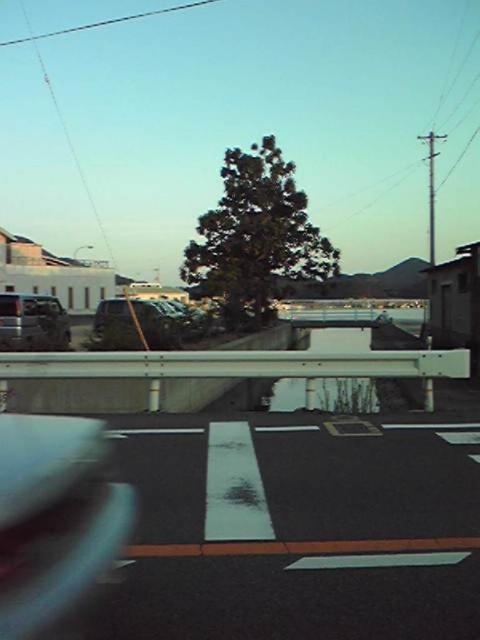
Find the location of a particular element. The image size is (480, 640). metallic silver car at center is located at coordinates (135, 324).

Does metallic silver car at center have a lesser width compared to transparent glass car window at lower left?

No.

What do you see at coordinates (135, 324) in the screenshot? I see `metallic silver car at center` at bounding box center [135, 324].

Find the location of a particular element. The image size is (480, 640). metallic silver car at center is located at coordinates (135, 324).

Who is taller, metallic silver car at center or metallic silver suv at left?

metallic silver suv at left

Who is positioned more to the left, metallic silver car at center or metallic silver suv at left?

From the viewer's perspective, metallic silver suv at left appears more on the left side.

Who is more forward, (122, 337) or (9, 298)?

Positioned in front is point (122, 337).

I want to click on metallic silver car at center, so click(135, 324).

Between metallic silver suv at left and transparent glass car window at lower left, which one has more height?

metallic silver suv at left is taller.

Is point (62, 339) in front of point (11, 298)?

Yes, point (62, 339) is in front of point (11, 298).

At what (x,y) coordinates should I click in order to perform the action: click on metallic silver suv at left. Please return your answer as a coordinate pair (x, y). Looking at the image, I should click on (33, 321).